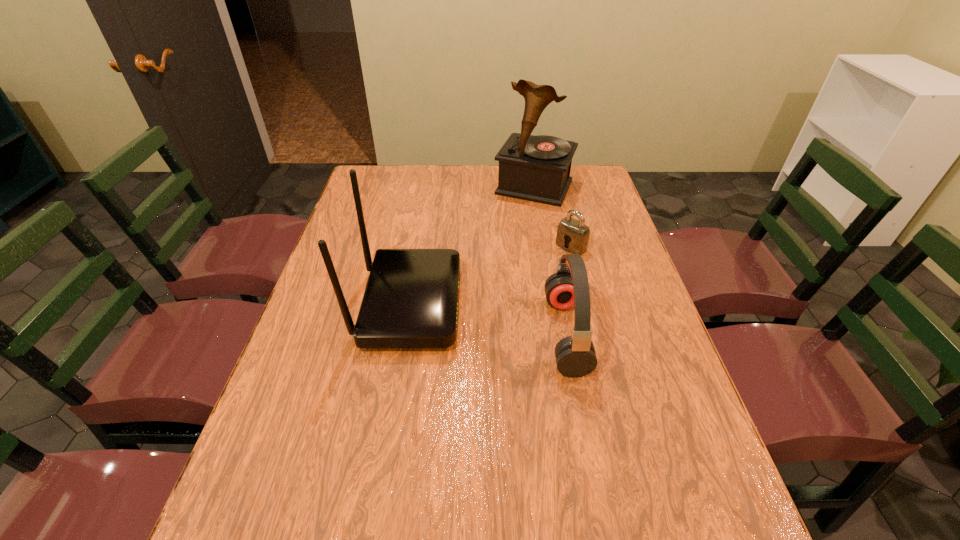
Image resolution: width=960 pixels, height=540 pixels. What are the coordinates of `free space located 0.260m at the front of the shortest object near the keyhole` in the screenshot? It's located at (504, 296).

Where is `blank space located 0.400m at the front of the shortest object near the keyhole`? This screenshot has width=960, height=540. blank space located 0.400m at the front of the shortest object near the keyhole is located at coordinates tap(468, 324).

What are the coordinates of `free space located 0.380m at the horn opening of the farthest object` in the screenshot? It's located at (487, 275).

At what (x,y) coordinates should I click in order to perform the action: click on blank space located 0.240m at the horn opening of the farthest object. Please return your answer as a coordinate pair (x, y). This screenshot has width=960, height=540. Looking at the image, I should click on (502, 246).

This screenshot has height=540, width=960. Identify the location of free space located 0.220m at the horn opening of the farthest object. (504, 242).

This screenshot has height=540, width=960. I want to click on object at the far edge, so click(537, 168).

Where is `object that is at the left edge`? The height and width of the screenshot is (540, 960). object that is at the left edge is located at coordinates (411, 298).

Find the location of `padlock that is at the right edge`. padlock that is at the right edge is located at coordinates (573, 235).

Locate an element on the screen. Image resolution: width=960 pixels, height=540 pixels. phonograph_record that is at the right edge is located at coordinates (537, 168).

Identify the location of object located in the far right corner section of the desktop. Image resolution: width=960 pixels, height=540 pixels. (537, 168).